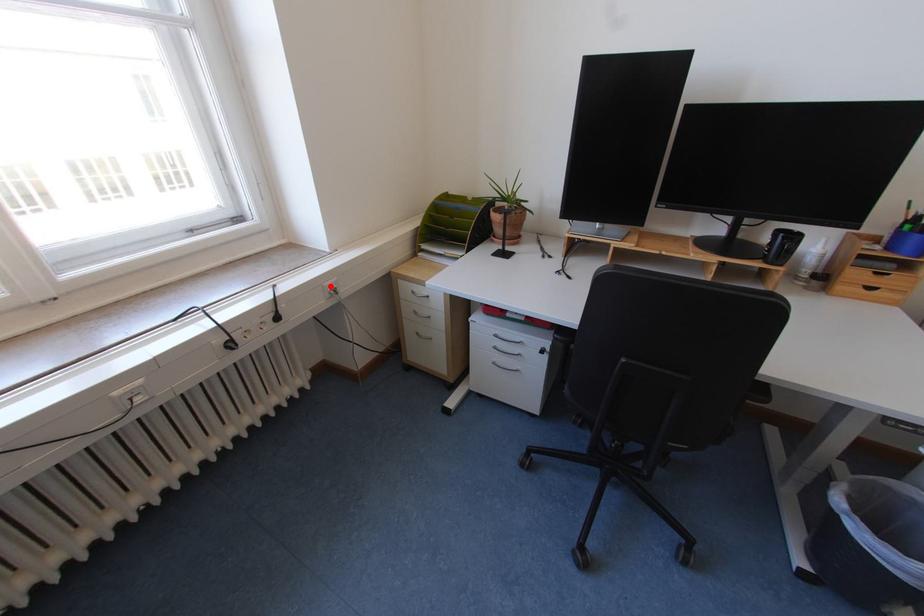
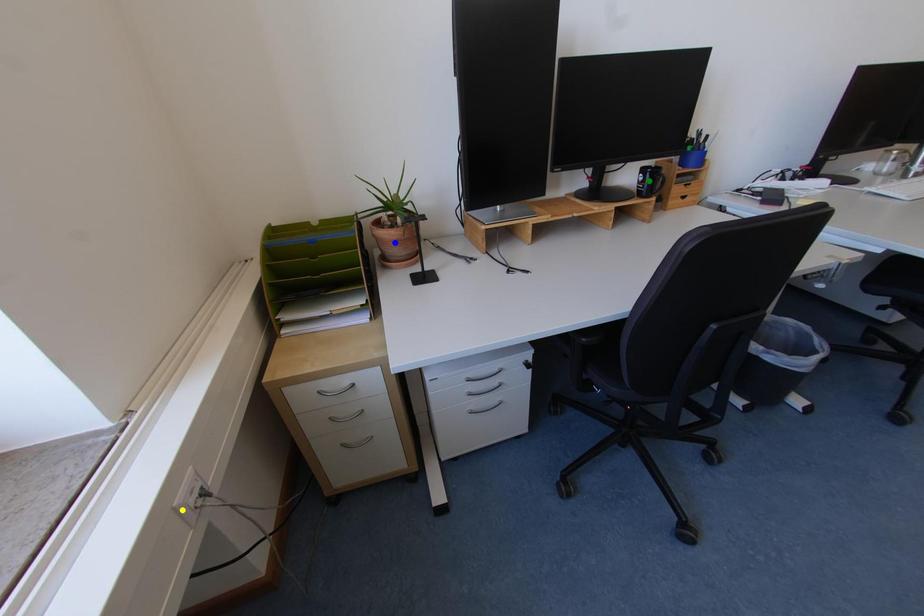
Question: I am providing you with two images of the same scene from different viewpoints. A red point is marked on the first image. You are given multiple points on the second image. Which point in image 2 is actually the same real-world point as the red point in image 1?

Choices:
 (A) green point
 (B) yellow point
 (C) blue point

Answer: (B)